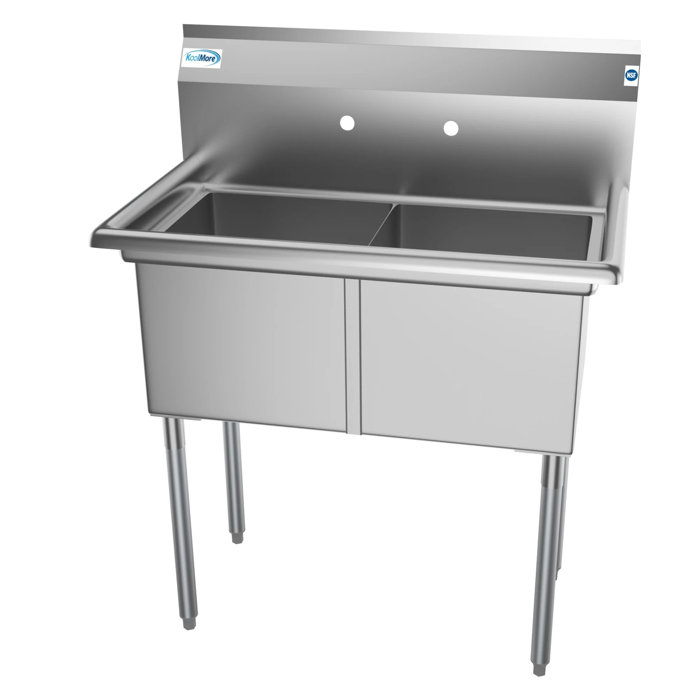
This screenshot has height=700, width=700. I want to click on drysink, so click(x=484, y=407).